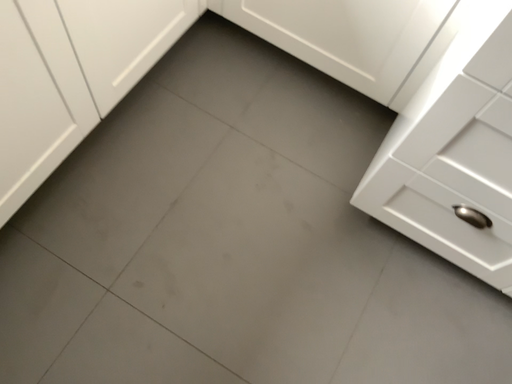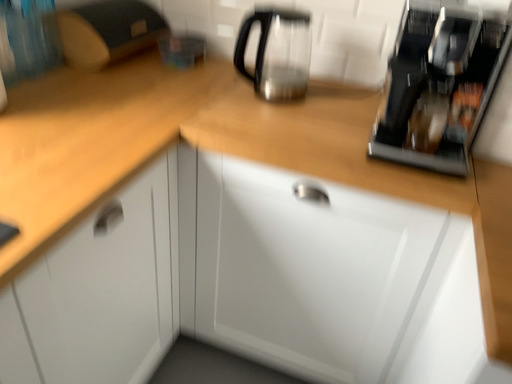
Question: How did the camera likely rotate when shooting the video?

Choices:
 (A) rotated downward
 (B) rotated upward

Answer: (B)